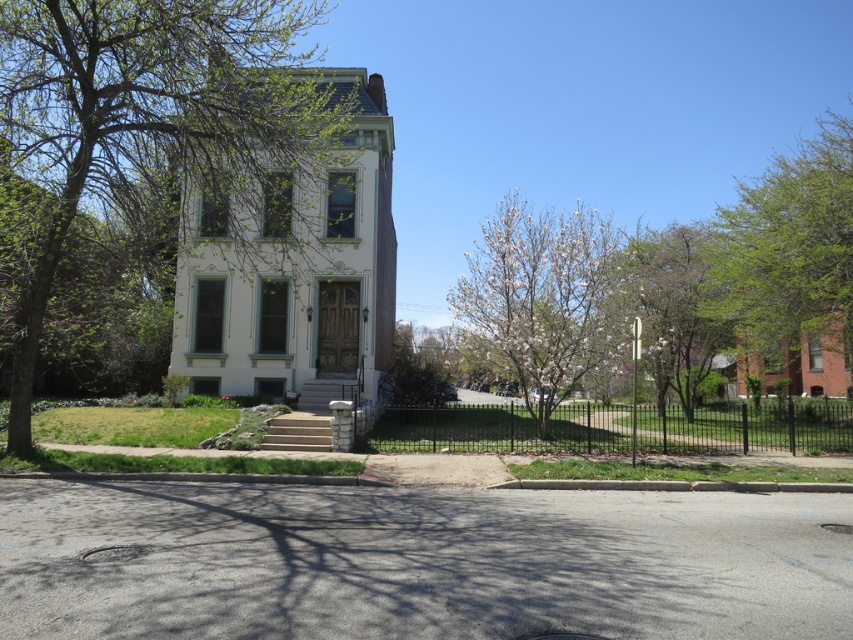
Can you confirm if green leafy tree at upper right is shorter than smooth white blossoms at center?

Incorrect, green leafy tree at upper right's height does not fall short of smooth white blossoms at center's.

Between point (767, 237) and point (619, 305), which one is positioned in front?

Point (619, 305)

At what (x,y) coordinates should I click in order to perform the action: click on green leafy tree at upper right. Please return your answer as a coordinate pair (x, y). Looking at the image, I should click on (791, 250).

Is green leafy tree at center below white blossoming tree at center?

No, green leafy tree at center is not below white blossoming tree at center.

Can you confirm if green leafy tree at center is wider than white blossoming tree at center?

In fact, green leafy tree at center might be narrower than white blossoming tree at center.

Which is in front, point (27, 358) or point (581, 220)?

Point (27, 358) is more forward.

Locate an element on the screen. This screenshot has width=853, height=640. green leafy tree at center is located at coordinates (160, 124).

Can you confirm if green leafy tree at center is shorter than green leafy tree at upper right?

Incorrect, green leafy tree at center's height does not fall short of green leafy tree at upper right's.

Is point (173, 86) farther from camera compared to point (784, 218)?

No, it is not.

Identify the location of green leafy tree at center. This screenshot has width=853, height=640. (160, 124).

The image size is (853, 640). I want to click on green leafy tree at center, so click(160, 124).